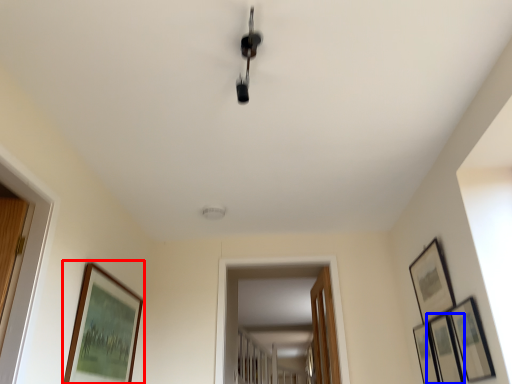
Question: Which object is further to the camera taking this photo, picture frame (highlighted by a red box) or picture frame (highlighted by a blue box)?

Choices:
 (A) picture frame
 (B) picture frame

Answer: (B)